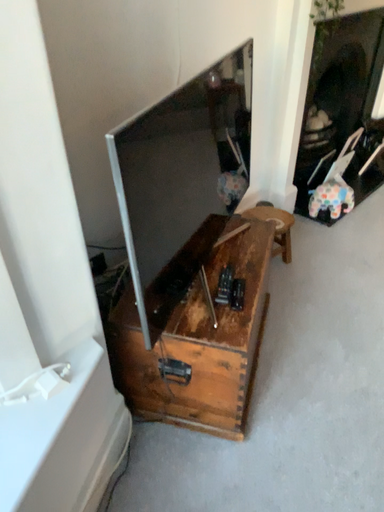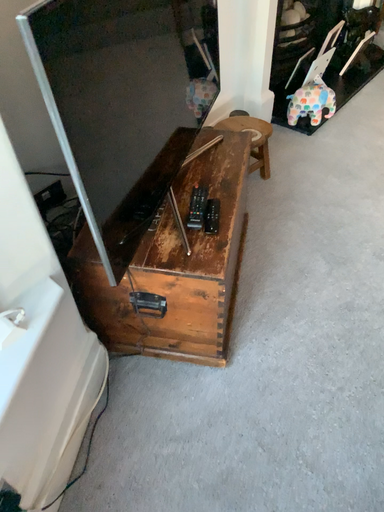
Question: Which way did the camera rotate in the video?

Choices:
 (A) rotated downward
 (B) rotated upward

Answer: (A)